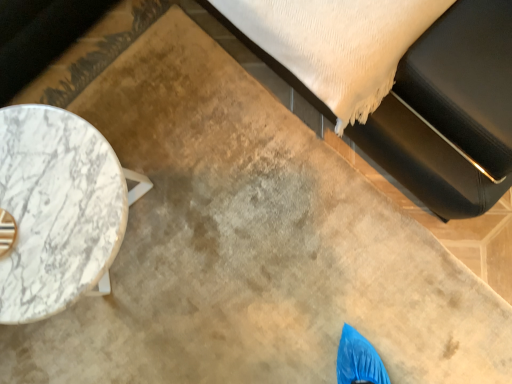
Locate an element on the screen. black leather bed at upper right is located at coordinates (450, 112).

Image resolution: width=512 pixels, height=384 pixels. What do you see at coordinates (450, 112) in the screenshot?
I see `black leather bed at upper right` at bounding box center [450, 112].

The height and width of the screenshot is (384, 512). Describe the element at coordinates (58, 210) in the screenshot. I see `white marble table at left` at that location.

Where is `white marble table at left`? white marble table at left is located at coordinates (58, 210).

This screenshot has height=384, width=512. What are the coordinates of `black leather bed at upper right` in the screenshot? It's located at (450, 112).

Between white marble table at left and black leather bed at upper right, which one appears on the right side from the viewer's perspective?

black leather bed at upper right is more to the right.

Considering their positions, is white marble table at left located in front of or behind black leather bed at upper right?

Visually, white marble table at left is located behind black leather bed at upper right.

Is point (6, 170) positioned before point (464, 87)?

That is False.

From the image's perspective, is white marble table at left above or below black leather bed at upper right?

Clearly, from the image's perspective, white marble table at left is below black leather bed at upper right.

From a real-world perspective, between white marble table at left and black leather bed at upper right, who is vertically higher?

black leather bed at upper right.

Between white marble table at left and black leather bed at upper right, which one has smaller width?

With smaller width is white marble table at left.

Considering the sizes of white marble table at left and black leather bed at upper right in the image, is white marble table at left taller or shorter than black leather bed at upper right?

Clearly, white marble table at left is shorter compared to black leather bed at upper right.

Is white marble table at left smaller than black leather bed at upper right?

Yes.

Would you say white marble table at left is inside or outside black leather bed at upper right?

white marble table at left exists outside the volume of black leather bed at upper right.

Is white marble table at left with black leather bed at upper right?

No, white marble table at left is not in contact with black leather bed at upper right.

From the picture: Could you tell me if white marble table at left is turned towards black leather bed at upper right?

No, white marble table at left is not oriented towards black leather bed at upper right.

How many degrees apart are the facing directions of white marble table at left and black leather bed at upper right?

90 degrees.

The image size is (512, 384). Identify the location of bed on the right of white marble table at left. click(x=450, y=112).

Does black leather bed at upper right appear on the left side of white marble table at left?

No.

Does black leather bed at upper right come in front of white marble table at left?

Yes, black leather bed at upper right is in front of white marble table at left.

Considering the points (480, 10) and (35, 279), which point is in front, point (480, 10) or point (35, 279)?

The point (35, 279) is closer.

Based on the photo, from the image's perspective, which one is positioned lower, black leather bed at upper right or white marble table at left?

white marble table at left, from the image's perspective.

From a real-world perspective, which object rests below the other?

From a 3D spatial view, white marble table at left is below.

Is black leather bed at upper right wider or thinner than white marble table at left?

black leather bed at upper right is wider than white marble table at left.

Considering the sizes of objects black leather bed at upper right and white marble table at left in the image provided, who is taller, black leather bed at upper right or white marble table at left?

With more height is black leather bed at upper right.

Between black leather bed at upper right and white marble table at left, which one has smaller size?

Smaller between the two is white marble table at left.

Is white marble table at left a part of black leather bed at upper right?

No, black leather bed at upper right does not contain white marble table at left.

Is black leather bed at upper right positioned far away from white marble table at left?

black leather bed at upper right is near white marble table at left, not far away.

In the scene shown: Is black leather bed at upper right facing towards white marble table at left?

Yes.

Can you tell me how much black leather bed at upper right and white marble table at left differ in facing direction?

They differ by 90 degrees in their facing directions.

Measure the distance between black leather bed at upper right and white marble table at left.

black leather bed at upper right and white marble table at left are 24.03 inches apart.

Where is `bed in front of the white marble table at left`? Image resolution: width=512 pixels, height=384 pixels. bed in front of the white marble table at left is located at coordinates (450, 112).

Image resolution: width=512 pixels, height=384 pixels. Identify the location of bed above the white marble table at left (from the image's perspective). (450, 112).

At what (x,y) coordinates should I click in order to perform the action: click on bed that appears in front of the white marble table at left. Please return your answer as a coordinate pair (x, y). Image resolution: width=512 pixels, height=384 pixels. Looking at the image, I should click on (450, 112).